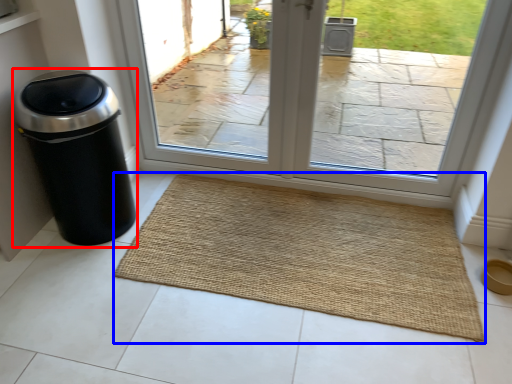
Question: Which point is further to the camera, waste container (highlighted by a red box) or mat (highlighted by a blue box)?

Choices:
 (A) waste container
 (B) mat

Answer: (B)